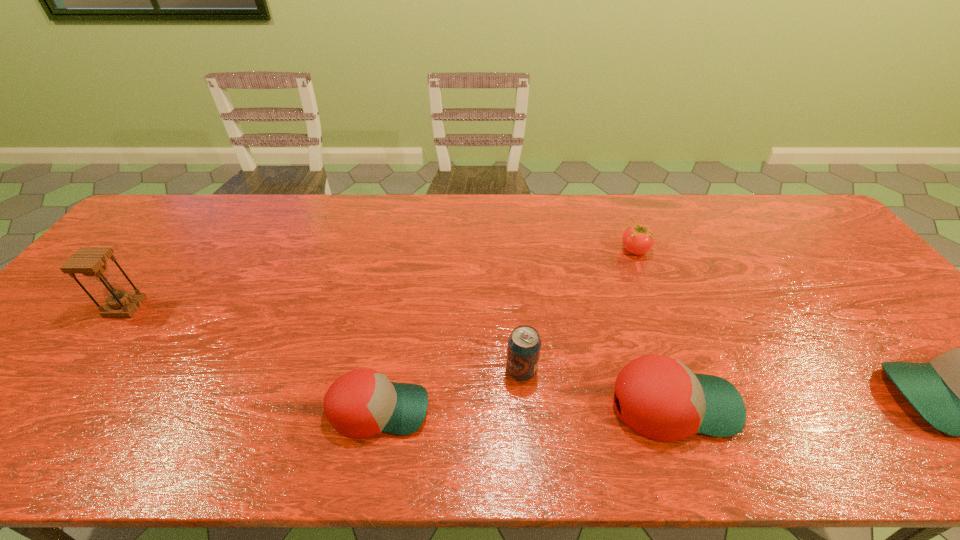
Where is `the shortest baseball cap`? Image resolution: width=960 pixels, height=540 pixels. the shortest baseball cap is located at coordinates (361, 403).

This screenshot has width=960, height=540. I want to click on the second object from left to right, so click(361, 403).

This screenshot has width=960, height=540. In order to click on the second baseball cap from left to right in this screenshot , I will do `click(660, 398)`.

You are a GUI agent. You are given a task and a screenshot of the screen. Output one action in this format:
    pyautogui.click(x=<x>, y=<y>)
    Task: Click on the fourth tallest object
    Image resolution: width=960 pixels, height=540 pixels.
    Given the screenshot: What is the action you would take?
    pyautogui.click(x=660, y=398)

Identify the location of the farthest object. (637, 239).

Locate an element on the screen. The width and height of the screenshot is (960, 540). the second farthest object is located at coordinates (90, 261).

You are a GUI agent. You are given a task and a screenshot of the screen. Output one action in this format:
    pyautogui.click(x=<x>, y=<y>)
    Task: Click on the hourglass
    The height and width of the screenshot is (540, 960).
    Given the screenshot: What is the action you would take?
    (90, 261)

Find the location of a particular element. the third object from left to right is located at coordinates (524, 343).

Where is `vacant space located 0.100m at the brim of the second object from left to right`? Image resolution: width=960 pixels, height=540 pixels. vacant space located 0.100m at the brim of the second object from left to right is located at coordinates (475, 409).

Identify the location of free space located at the brim of the second baseball cap from right to left. The height and width of the screenshot is (540, 960). (903, 405).